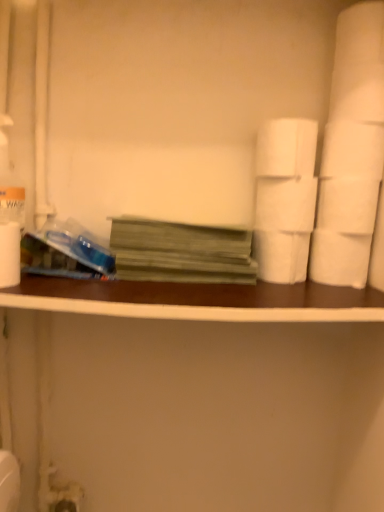
Where is `vacant space to the right of white matte paper towel at left`? Image resolution: width=384 pixels, height=512 pixels. vacant space to the right of white matte paper towel at left is located at coordinates (93, 288).